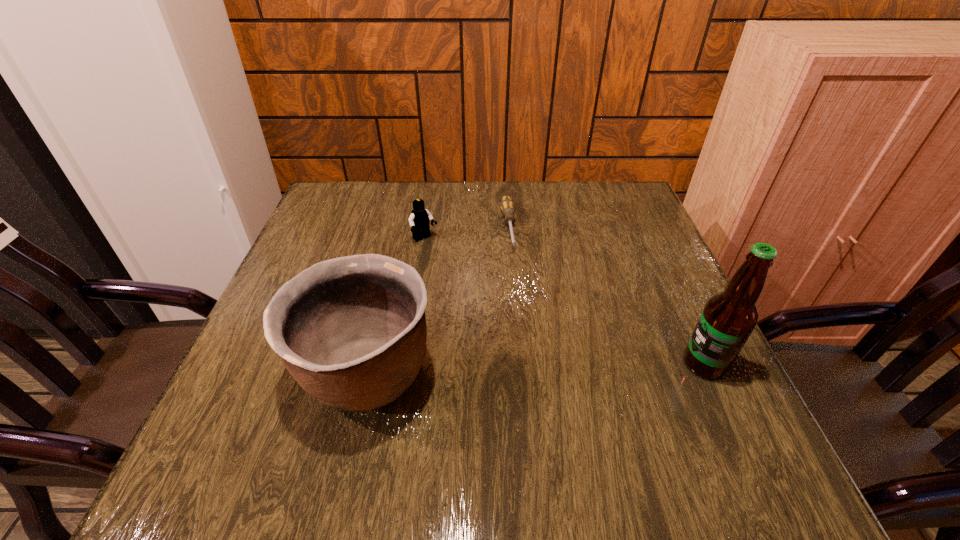
In order to click on object present at the near left corner in this screenshot , I will do `click(351, 330)`.

Where is `free space at the far edge of the desktop`? The image size is (960, 540). free space at the far edge of the desktop is located at coordinates (528, 182).

Where is `vacant space at the left edge of the desktop`? This screenshot has height=540, width=960. vacant space at the left edge of the desktop is located at coordinates (315, 243).

This screenshot has height=540, width=960. In order to click on vacant space at the right edge of the desktop in this screenshot , I will do `click(626, 252)`.

Locate an element on the screen. Image resolution: width=960 pixels, height=540 pixels. vacant space at the far left corner is located at coordinates (308, 226).

The height and width of the screenshot is (540, 960). In order to click on free region at the far right corner in this screenshot , I will do `click(586, 187)`.

Identify the location of free spot between the second tallest object and the rightmost object. This screenshot has height=540, width=960. (536, 369).

Find the location of a particular element. free space that is in between the pottery and the rightmost object is located at coordinates (536, 369).

Where is `vacant point located between the shortest object and the Lego`? This screenshot has height=540, width=960. vacant point located between the shortest object and the Lego is located at coordinates (467, 233).

I want to click on vacant region between the beer bottle and the third shortest object, so click(536, 369).